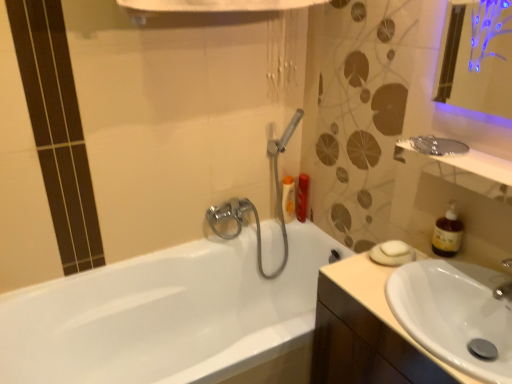
You are a GUI agent. You are given a task and a screenshot of the screen. Output one action in this format:
    pyautogui.click(x=<x>, y=<y>)
    Task: Click on the vacant region to the right of white matte soap at right
    
    Given the screenshot: What is the action you would take?
    pyautogui.click(x=450, y=270)